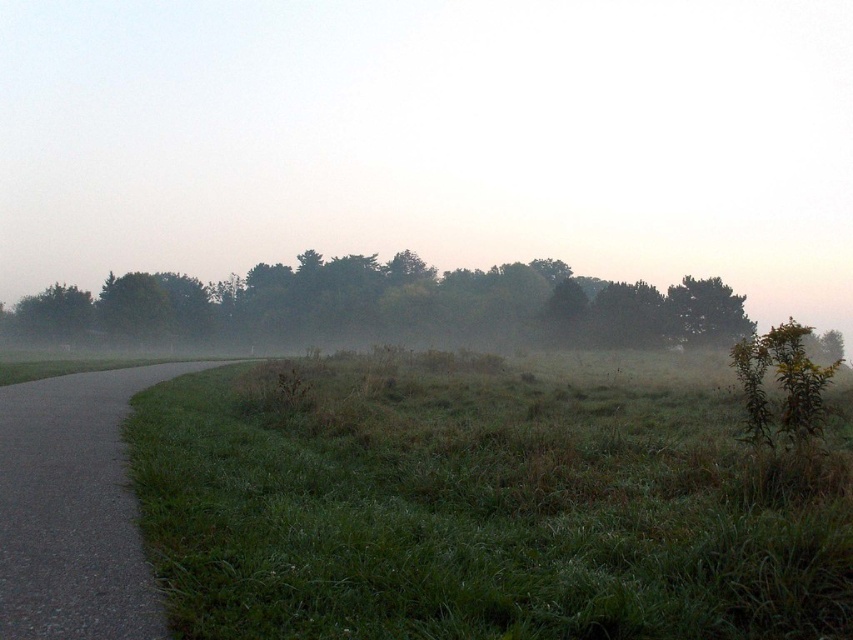
Question: Does green grassy at lower left appear on the left side of green matte trees at center?

Choices:
 (A) yes
 (B) no

Answer: (B)

Question: Does green grassy at lower left lie behind gray asphalt path at left?

Choices:
 (A) yes
 (B) no

Answer: (A)

Question: Which object appears closest to the camera in this image?

Choices:
 (A) green matte trees at center
 (B) gray asphalt path at left
 (C) green grassy at lower left

Answer: (B)

Question: Which of the following is the closest to the observer?

Choices:
 (A) (55, 429)
 (B) (59, 336)

Answer: (A)

Question: Can you confirm if green matte trees at center is smaller than gray asphalt path at left?

Choices:
 (A) no
 (B) yes

Answer: (A)

Question: Among these objects, which one is nearest to the camera?

Choices:
 (A) green matte trees at center
 (B) green grassy at lower left

Answer: (B)